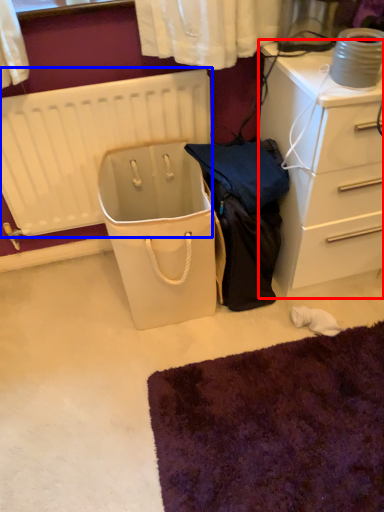
Question: Which point is further to the camera, chest of drawers (highlighted by a red box) or radiator (highlighted by a blue box)?

Choices:
 (A) chest of drawers
 (B) radiator

Answer: (B)